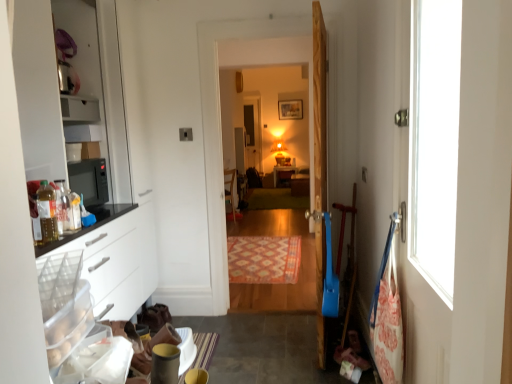
Find the location of a particular element. free space above matte yellow concrete at lower left (from a real-world perspective) is located at coordinates coord(254,345).